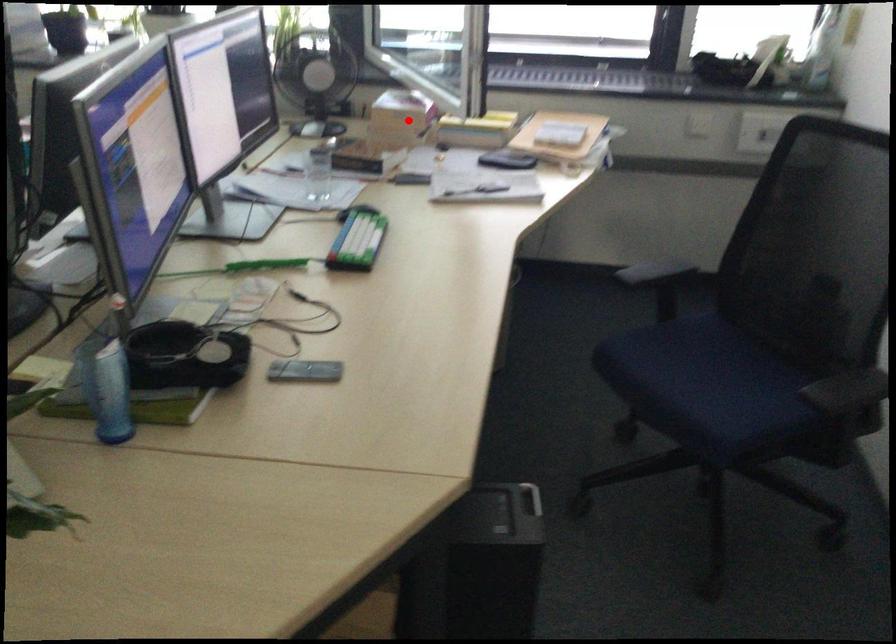
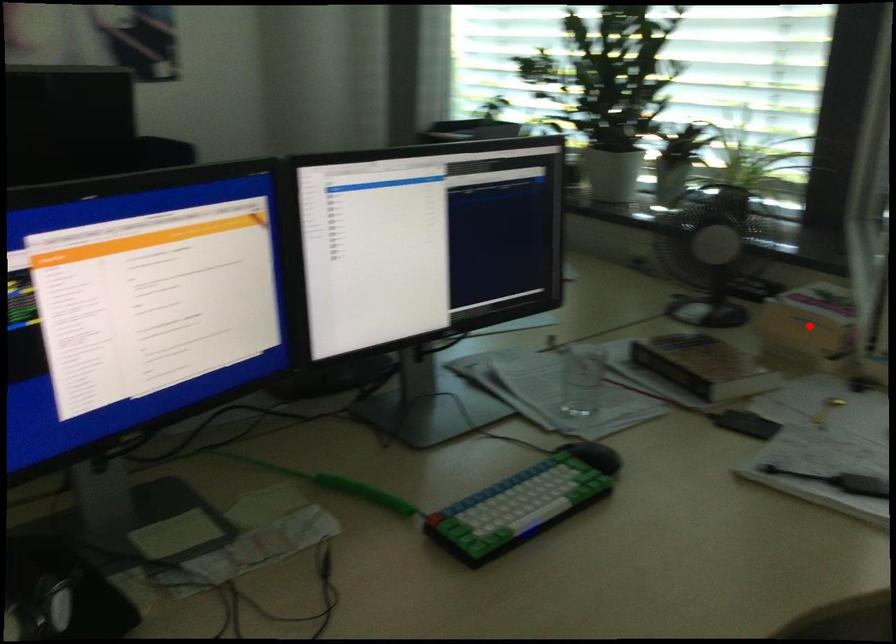
I am providing you with two images of the same scene from different viewpoints. A red point is marked on the first image and another point is marked on the second image. Are the points marked in image1 and image2 representing the same 3D position?

Yes